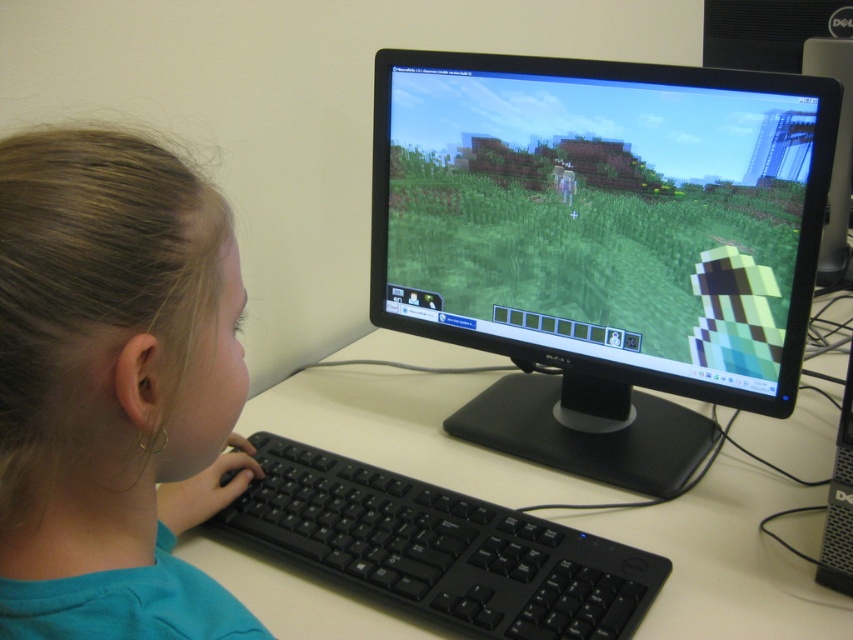
Can you confirm if black matte monitor at center is shorter than smooth skin face at center?

No, black matte monitor at center is not shorter than smooth skin face at center.

Which is in front, point (497, 346) or point (115, 385)?

Point (115, 385) is in front.

You are a GUI agent. You are given a task and a screenshot of the screen. Output one action in this format:
    pyautogui.click(x=<x>, y=<y>)
    Task: Click on the black matte monitor at center
    The image size is (853, 640).
    Given the screenshot: What is the action you would take?
    pyautogui.click(x=601, y=244)

Which is in front, point (561, 100) or point (403, 564)?

Positioned in front is point (403, 564).

Can you confirm if black matte monitor at center is positioned to the left of black plastic keyboard at center?

No, black matte monitor at center is not to the left of black plastic keyboard at center.

Which is in front, point (517, 196) or point (509, 592)?

Point (509, 592)

Image resolution: width=853 pixels, height=640 pixels. What are the coordinates of `black matte monitor at center` in the screenshot? It's located at (601, 244).

Does white plastic computer desk at center have a larger size compared to black plastic keyboard at center?

Indeed, white plastic computer desk at center has a larger size compared to black plastic keyboard at center.

Can you confirm if white plastic computer desk at center is shorter than black plastic keyboard at center?

Incorrect, white plastic computer desk at center's height does not fall short of black plastic keyboard at center's.

Identify the location of white plastic computer desk at center. (724, 560).

Locate an element on the screen. The height and width of the screenshot is (640, 853). white plastic computer desk at center is located at coordinates (724, 560).